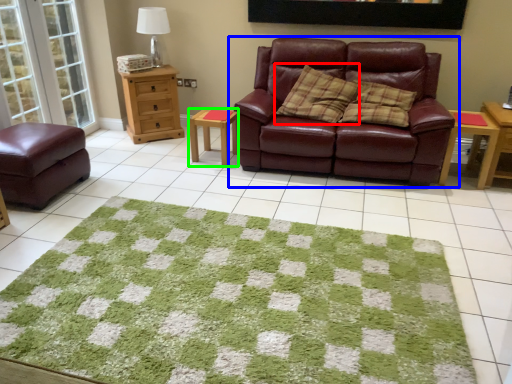
Question: Based on their relative distances, which object is nearer to pillow (highlighted by a red box)? Choose from studio couch (highlighted by a blue box) and table (highlighted by a green box).

Choices:
 (A) studio couch
 (B) table

Answer: (A)